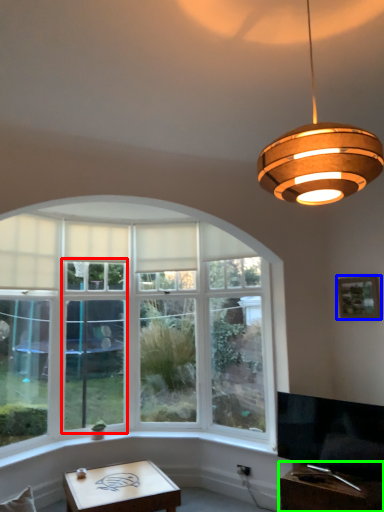
Question: Which is nearer to the glass door (highlighted by a red box)? picture frame (highlighted by a blue box) or table (highlighted by a green box).

Choices:
 (A) picture frame
 (B) table

Answer: (B)